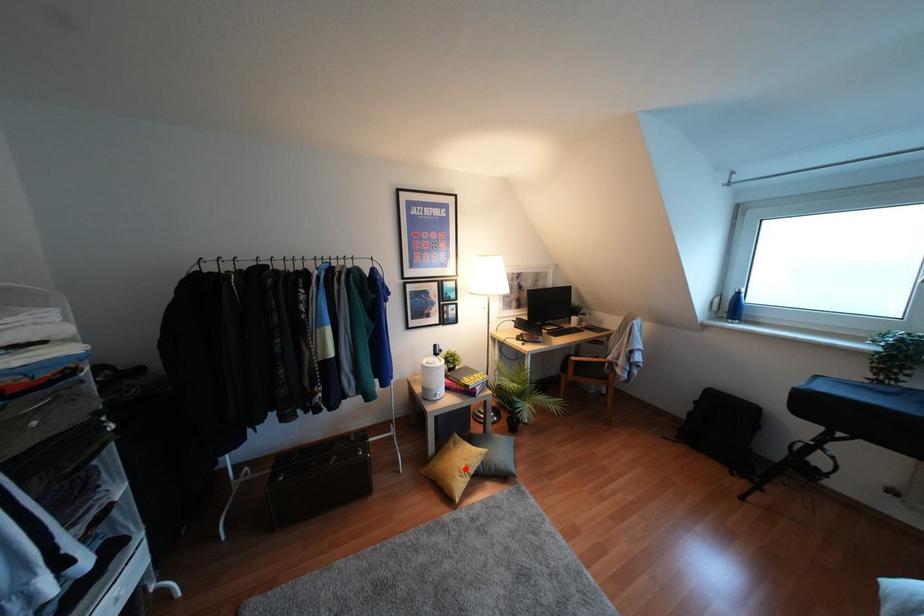
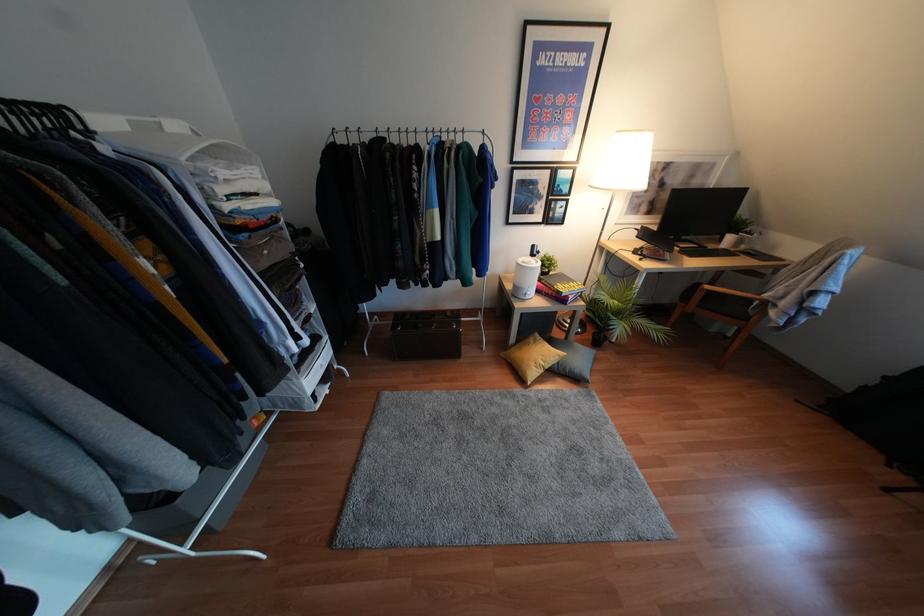
Where in the second image is the point corresponding to the highlighted location from the first image?

(541, 363)